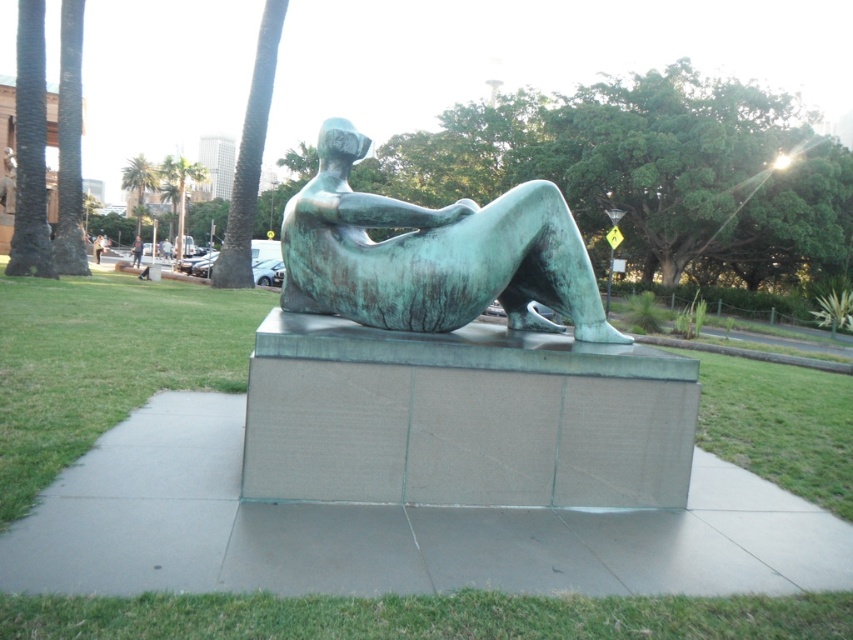
Who is higher up, green leafy palm tree at upper center or green textured palm tree at upper left?

green leafy palm tree at upper center

Is green leafy palm tree at upper center bigger than green textured palm tree at upper left?

No, green leafy palm tree at upper center is not bigger than green textured palm tree at upper left.

Who is more forward, (128, 189) or (206, 173)?

Point (206, 173) is in front.

I want to click on green leafy palm tree at upper center, so click(x=138, y=182).

Does green patina statue at center have a larger size compared to blue-green bronze statue at center?

Incorrect, green patina statue at center is not larger than blue-green bronze statue at center.

Which is in front, point (497, 196) or point (136, 236)?

Point (497, 196) is in front.

This screenshot has width=853, height=640. Identify the location of green patina statue at center. (433, 253).

Between point (183, 198) and point (135, 241), which one is positioned in front?

Point (183, 198) is in front.

Can you confirm if green textured palm tree at upper left is shorter than blue-green bronze statue at center?

Incorrect, green textured palm tree at upper left's height does not fall short of blue-green bronze statue at center's.

Is point (178, 205) behind point (134, 260)?

Yes.

Identify the location of green textured palm tree at upper left. The height and width of the screenshot is (640, 853). (183, 188).